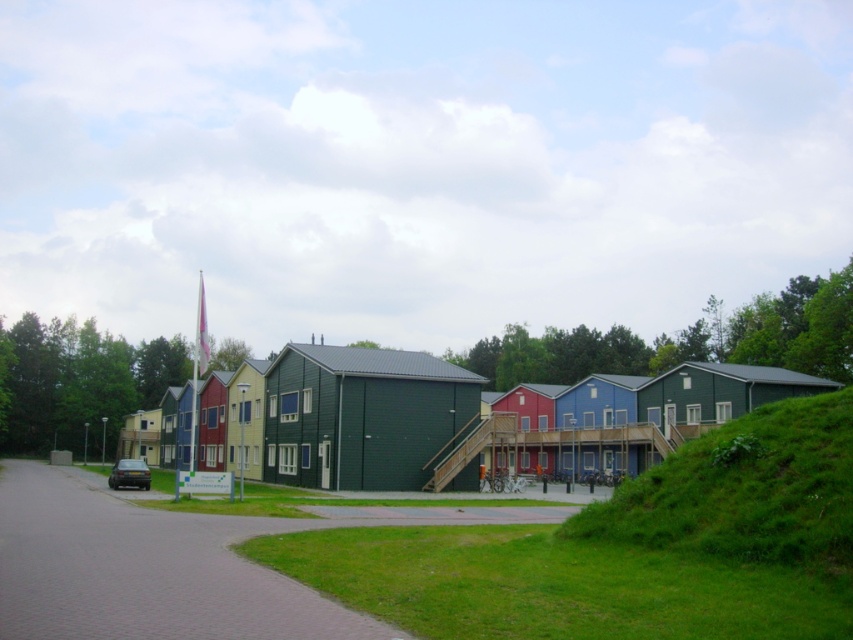
Does point (593, 524) come closer to viewer compared to point (325, 394)?

Yes, it is in front of point (325, 394).

Does green grassy hillside at lower right have a larger size compared to green wooden house at center?

Yes.

Identify the location of green grassy hillside at lower right. (744, 490).

What are the coordinates of `green grassy hillside at lower right` in the screenshot? It's located at (744, 490).